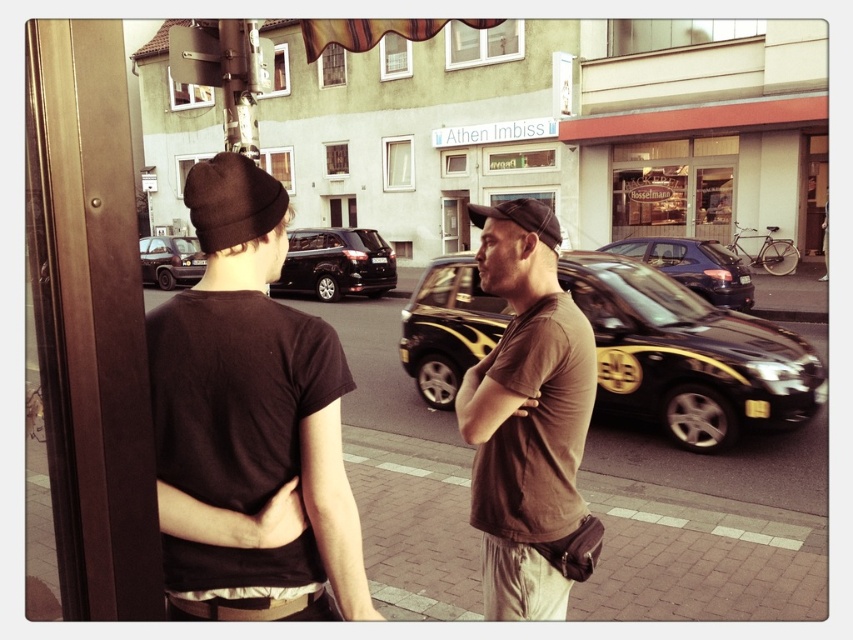
You are standing at the point marked by the coordinates point (688,355). What object is exactly at this location?

The black metallic car at center is exactly at point (688,355).

You are a delivery driver who needs to park your vehicle in this street scene. You have a truck that is the same size as the black metallic car at center. There is a parking spot that can only accommodate vehicles as small as the matte black van at left. Will your truck fit in this parking spot?

The black metallic car at center is larger than the matte black van at left. Since your truck is the same size as the black metallic car at center, it will not fit in a parking spot designed for vehicles as small as the matte black van at left.

You are a delivery driver who needs to park your vehicle between the black metallic car at center and the shiny black suv at center. Given that your truck is 1.8 meters tall, can you safely park there without hitting the overhead structure?

The black metallic car at center is taller than the shiny black suv at center. Since the truck is 1.8 meters tall, but the height of the overhead structure isn t mentioned, it s impossible to determine if parking is safe.